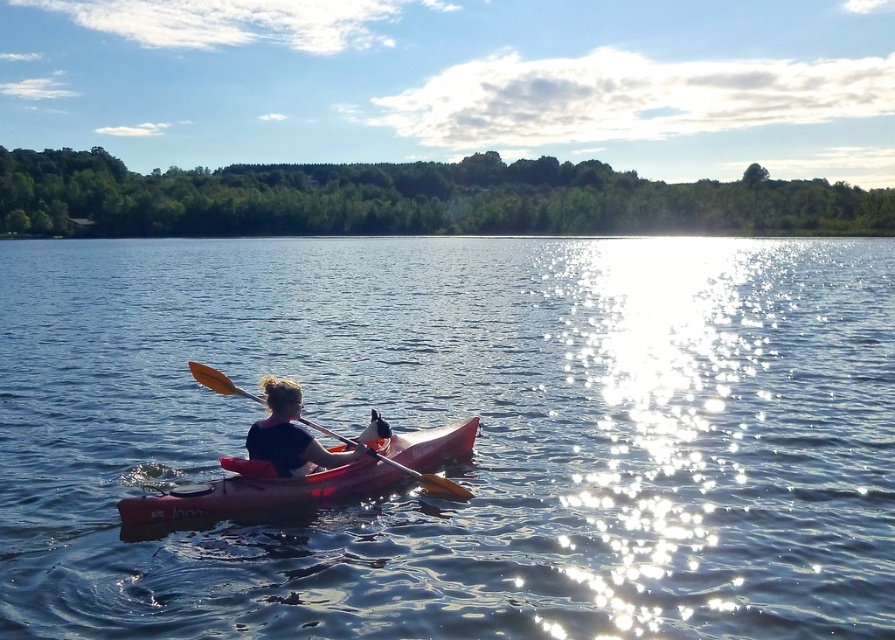
Who is more distant from viewer, (283, 401) or (422, 483)?

Positioned behind is point (422, 483).

This screenshot has height=640, width=895. What do you see at coordinates (290, 435) in the screenshot? I see `matte pink kayak at center` at bounding box center [290, 435].

Between point (290, 442) and point (253, 396), which one is positioned behind?

Point (253, 396)

This screenshot has height=640, width=895. Find the location of `matte pink kayak at center`. matte pink kayak at center is located at coordinates (290, 435).

Between point (169, 518) and point (301, 396), which one is positioned in front?

Positioned in front is point (169, 518).

What do you see at coordinates (258, 490) in the screenshot? The image size is (895, 640). I see `matte red canoe at center` at bounding box center [258, 490].

Measure the distance between point [244,490] and camera.

A distance of 8.56 meters exists between point [244,490] and camera.

The height and width of the screenshot is (640, 895). Find the location of `matte red canoe at center`. matte red canoe at center is located at coordinates (258, 490).

Is matte red canoe at center bigger than orange wood paddle at center?

Correct, matte red canoe at center is larger in size than orange wood paddle at center.

Looking at this image, who is higher up, matte red canoe at center or orange wood paddle at center?

matte red canoe at center

This screenshot has height=640, width=895. What do you see at coordinates (258, 490) in the screenshot?
I see `matte red canoe at center` at bounding box center [258, 490].

Locate an element on the screen. matte red canoe at center is located at coordinates (258, 490).